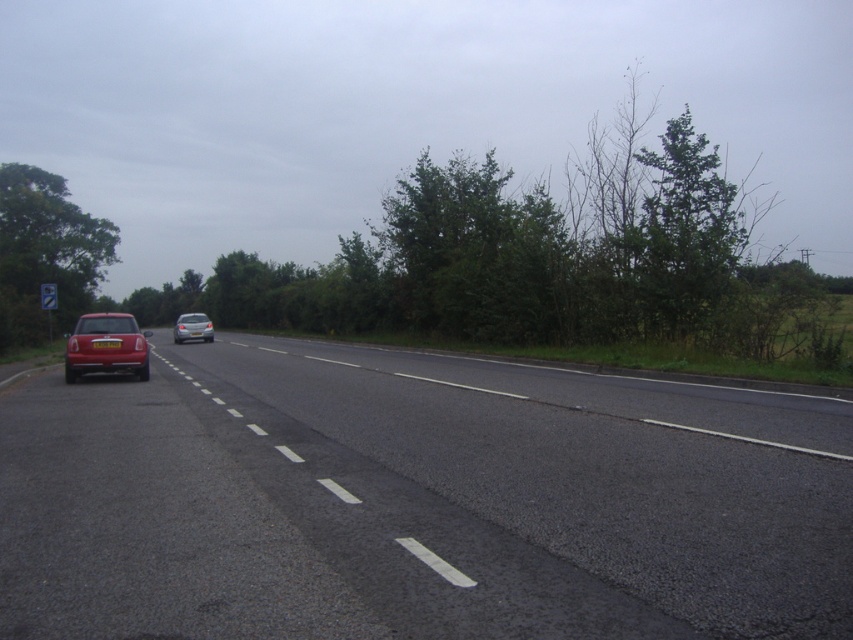
You are a self driving car navigating the two lane road in the image. You see two points on the road ahead, point 1 at coordinates point (36, 234) and point 2 at coordinates point (210, 326). Which point is closer to your current position?

Point 1 at coordinates point (36, 234) is closer to your current position because it is behind point 2 at coordinates point (210, 326), meaning point 1 is nearer to you.

You are a driver approaching the shiny red car at left and the satin silver car at center on this wet road. Which car should you be cautious of overtaking due to its size?

The satin silver car at center is larger than the shiny red car at left, so overtaking the satin silver car at center might be more challenging due to its size, requiring extra caution.